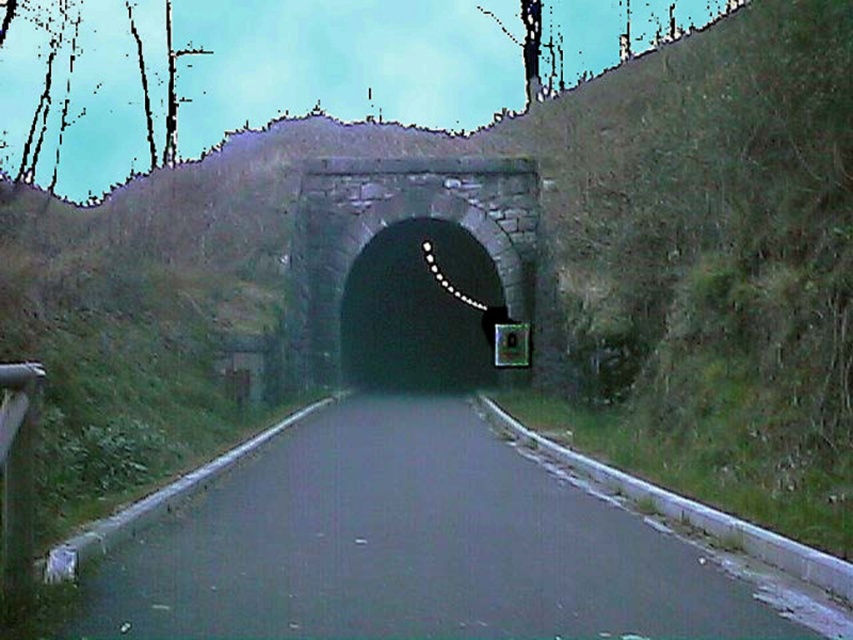
From the picture: Can you confirm if asphalt road at center is positioned above dark stone tunnel at center?

Incorrect, asphalt road at center is not positioned above dark stone tunnel at center.

Can you confirm if asphalt road at center is smaller than dark stone tunnel at center?

Yes, asphalt road at center is smaller than dark stone tunnel at center.

Does point (498, 529) come closer to viewer compared to point (422, 198)?

Yes, point (498, 529) is closer to viewer.

The width and height of the screenshot is (853, 640). What are the coordinates of `asphalt road at center` in the screenshot? It's located at (410, 545).